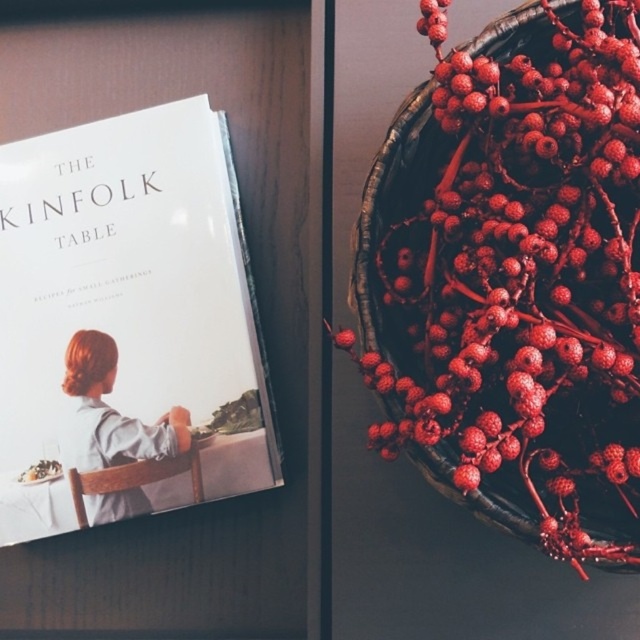
I want to click on shiny red berries at upper right, so click(x=515, y=275).

Can you confirm if shiny red berries at upper right is positioned below white matte book at upper left?

No, shiny red berries at upper right is not below white matte book at upper left.

This screenshot has width=640, height=640. I want to click on shiny red berries at upper right, so click(x=515, y=275).

Who is more distant from viewer, (440, 346) or (97, 448)?

The point (97, 448) is behind.

Is point (358, 314) positioned behind point (182, 436)?

No, it is not.

Identify the location of shiny red berries at upper right. This screenshot has width=640, height=640. (515, 275).

Identify the location of white matte book at upper left. (125, 308).

Between point (182, 376) and point (104, 339), which one is positioned in front?

Positioned in front is point (182, 376).

Where is `white matte book at upper left`? Image resolution: width=640 pixels, height=640 pixels. white matte book at upper left is located at coordinates (125, 308).